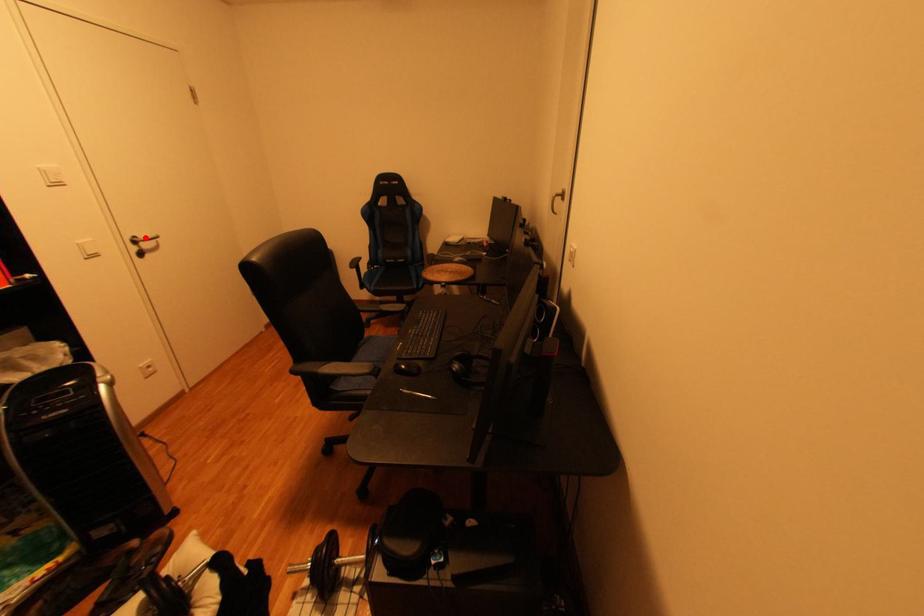
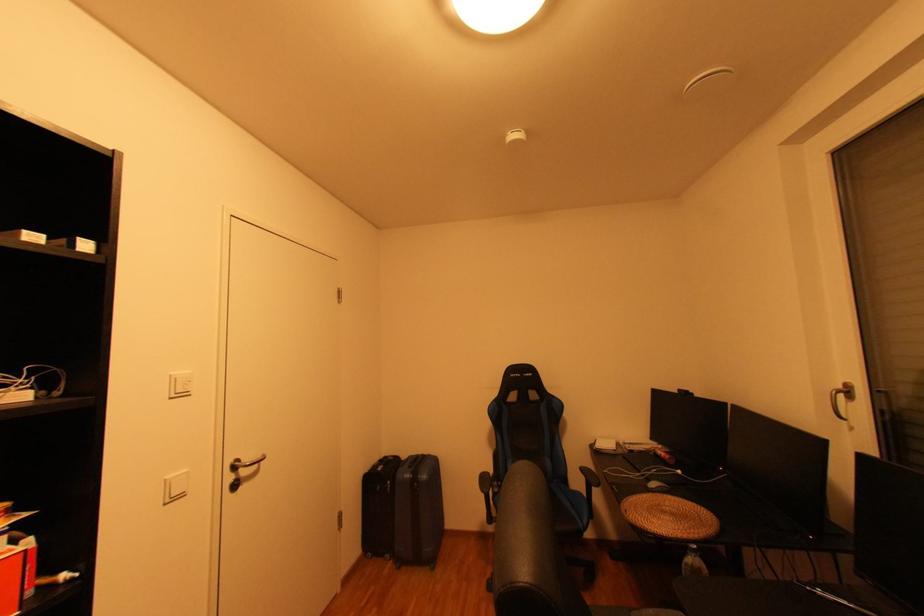
The point at the highlighted location is marked in the first image. Where is the corresponding point in the second image?

(247, 461)